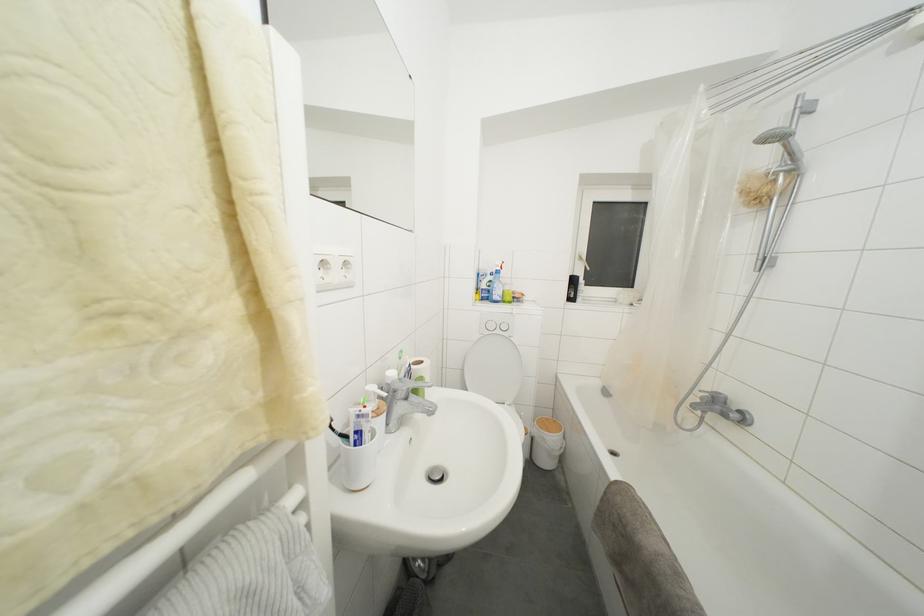
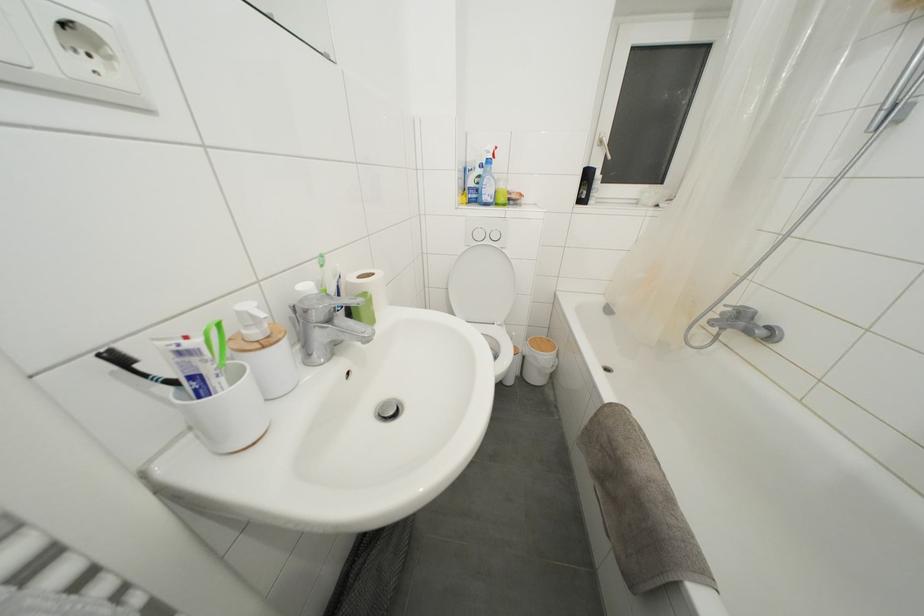
Find the pixel in the second image that matches point (578, 286) in the first image.

(591, 180)